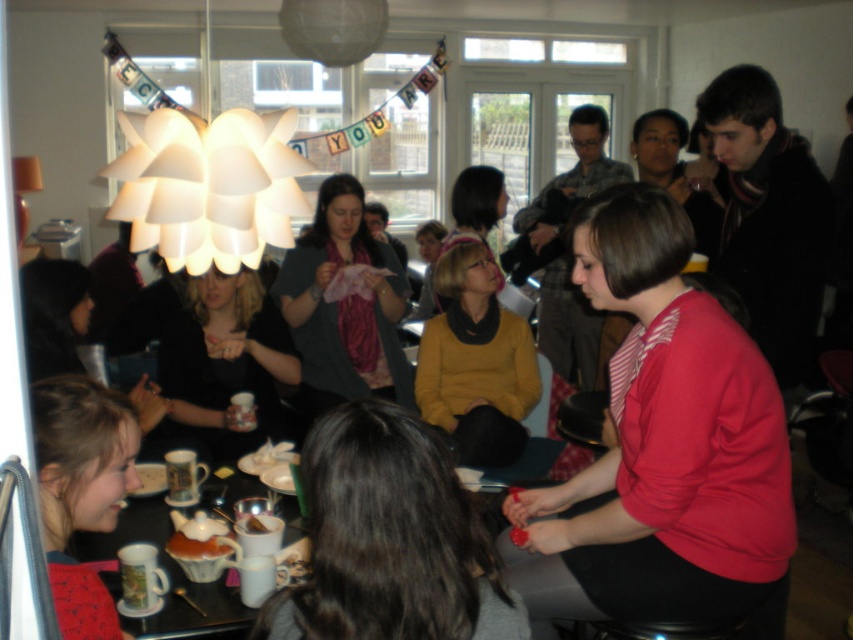
Is point (732, 428) closer to camera compared to point (374, 525)?

No, (732, 428) is further to viewer.

Looking at this image, who is higher up, matte red blouse at center or dark brown hair at center?

matte red blouse at center

Is point (627, 195) more distant than point (492, 605)?

Yes, point (627, 195) is behind point (492, 605).

Identify the location of matte red blouse at center. (662, 448).

Who is higher up, matte black hair at left or yellow sweater at center?

yellow sweater at center is higher up.

Does matte black hair at left appear on the right side of yellow sweater at center?

No, matte black hair at left is not to the right of yellow sweater at center.

The height and width of the screenshot is (640, 853). What do you see at coordinates (54, 316) in the screenshot?
I see `matte black hair at left` at bounding box center [54, 316].

Find the location of a particular element. The width and height of the screenshot is (853, 640). matte black hair at left is located at coordinates (54, 316).

Is point (593, 253) closer to camera compared to point (41, 300)?

Yes, point (593, 253) is in front of point (41, 300).

Can you confirm if matte red blouse at center is smaller than matte black hair at left?

No.

Does point (784, 525) come closer to viewer compared to point (61, 291)?

Yes, point (784, 525) is in front of point (61, 291).

Identify the location of matte red blouse at center. pos(662,448).